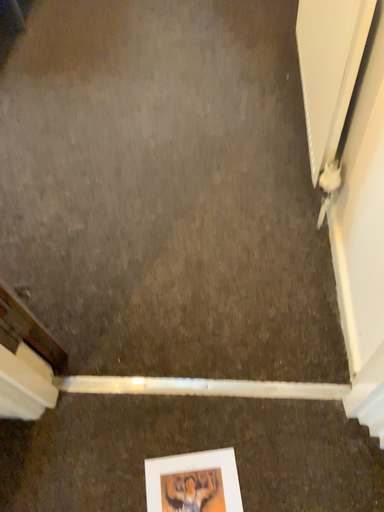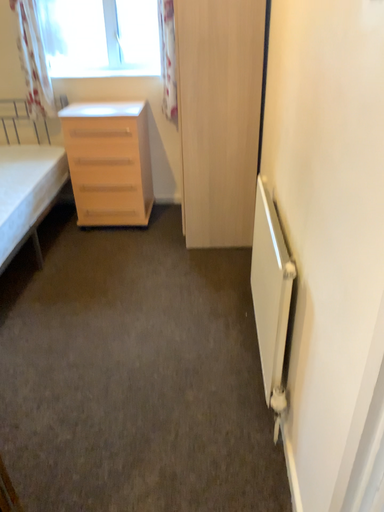
Question: How did the camera likely rotate when shooting the video?

Choices:
 (A) rotated downward
 (B) rotated upward

Answer: (B)